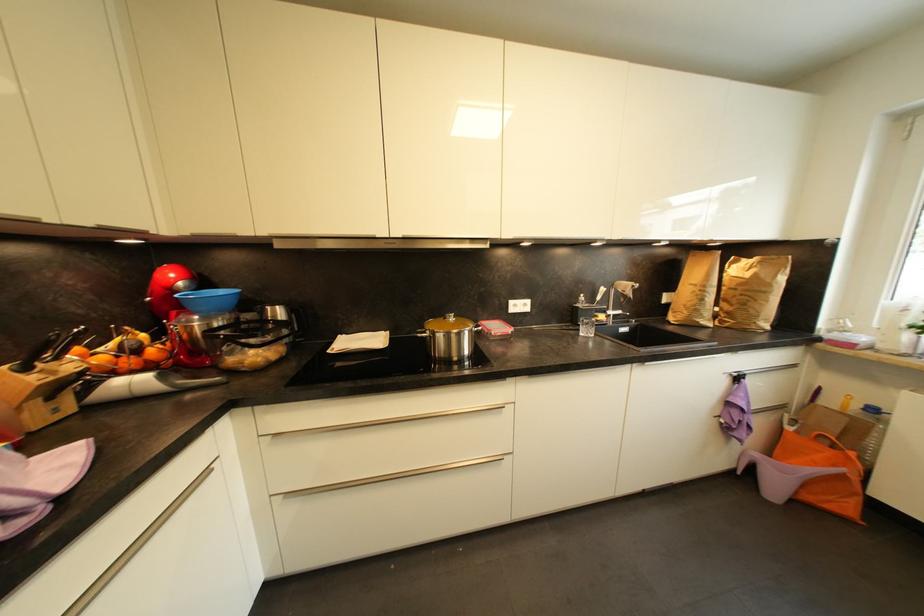
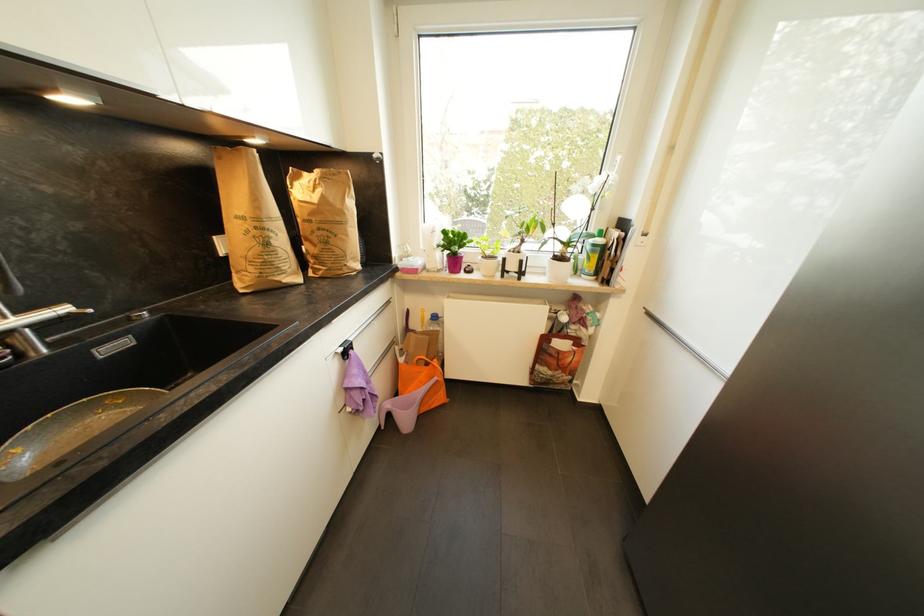
In the second image, find the point that corresponds to pixel 760 456 in the first image.

(393, 407)